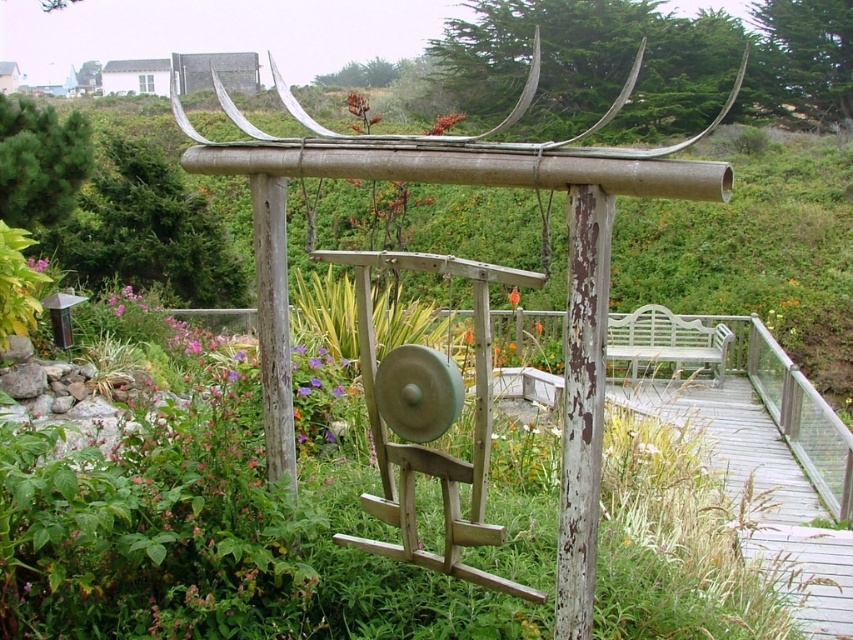
Question: Which point is farther to the camera?

Choices:
 (A) (453, 122)
 (B) (515, 292)
 (C) (583, 202)
 (D) (267, 496)

Answer: (B)

Question: Which of the following is the farthest from the observer?

Choices:
 (A) wooden gong at center
 (B) purple matte flower at center
 (C) orange matte flower at center
 (D) pink matte flower at upper left

Answer: (B)

Question: Does orange matte flower at center appear under pink matte flower at upper left?

Choices:
 (A) yes
 (B) no

Answer: (B)

Question: Is orange matte flower at center wider than pink matte flower at upper left?

Choices:
 (A) yes
 (B) no

Answer: (A)

Question: Which object appears closest to the camera in this image?

Choices:
 (A) purple matte flower at center
 (B) wooden gong at center
 (C) rusty wood gong at center
 (D) pink matte flower at upper left

Answer: (C)

Question: Is wooden gong at center wider than rusty wood gong at center?

Choices:
 (A) yes
 (B) no

Answer: (B)